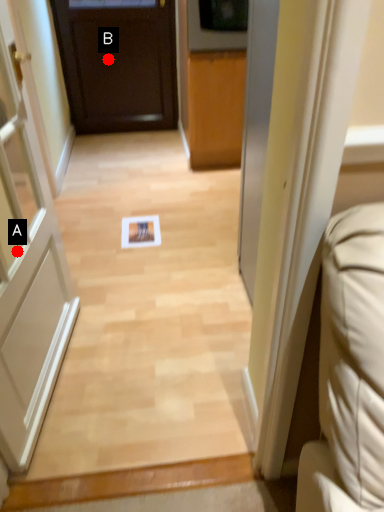
Question: Two points are circled on the image, labeled by A and B beside each circle. Which point appears farthest from the camera in this image?

Choices:
 (A) A is further
 (B) B is further

Answer: (B)